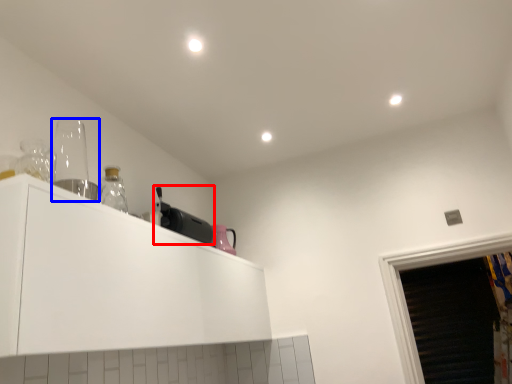
Question: Which object appears farthest to the camera in this image, appliance (highlighted by a red box) or appliance (highlighted by a blue box)?

Choices:
 (A) appliance
 (B) appliance

Answer: (A)